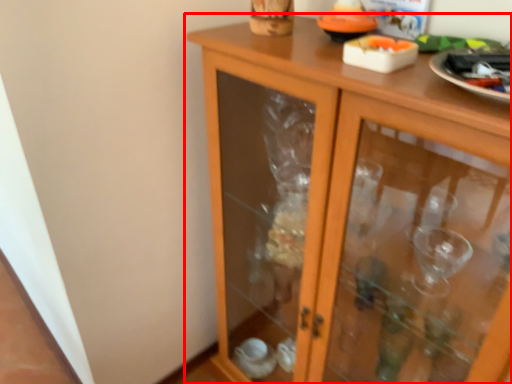
Question: From the image's perspective, where is cupboard (annotated by the red box) located relative to glass plate?

Choices:
 (A) below
 (B) above

Answer: (A)